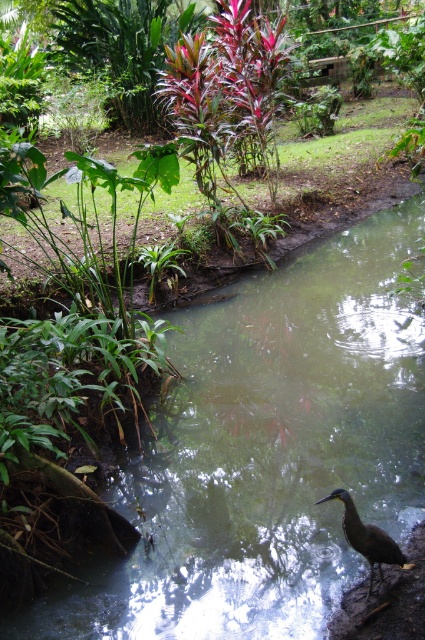
Who is more forward, (172, 524) or (382, 536)?

Point (382, 536) is in front.

Image resolution: width=425 pixels, height=640 pixels. Describe the element at coordinates (268, 452) in the screenshot. I see `greenish murky water at center` at that location.

You are a GUI agent. You are given a task and a screenshot of the screen. Output one action in this format:
    pyautogui.click(x=<x>, y=<y>)
    Task: Click on the greenish murky water at center
    Image resolution: width=425 pixels, height=640 pixels.
    Given the screenshot: What is the action you would take?
    pyautogui.click(x=268, y=452)